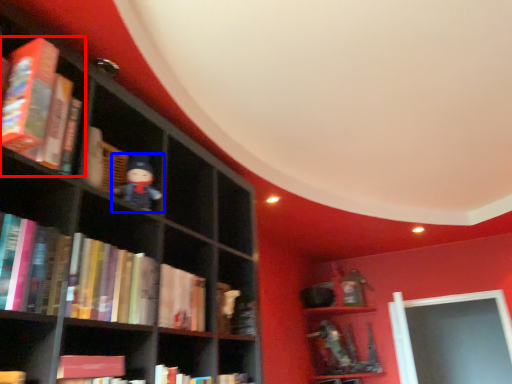
Question: Which object appears closest to the camera in this image, book (highlighted by a red box) or toy (highlighted by a blue box)?

Choices:
 (A) book
 (B) toy

Answer: (A)